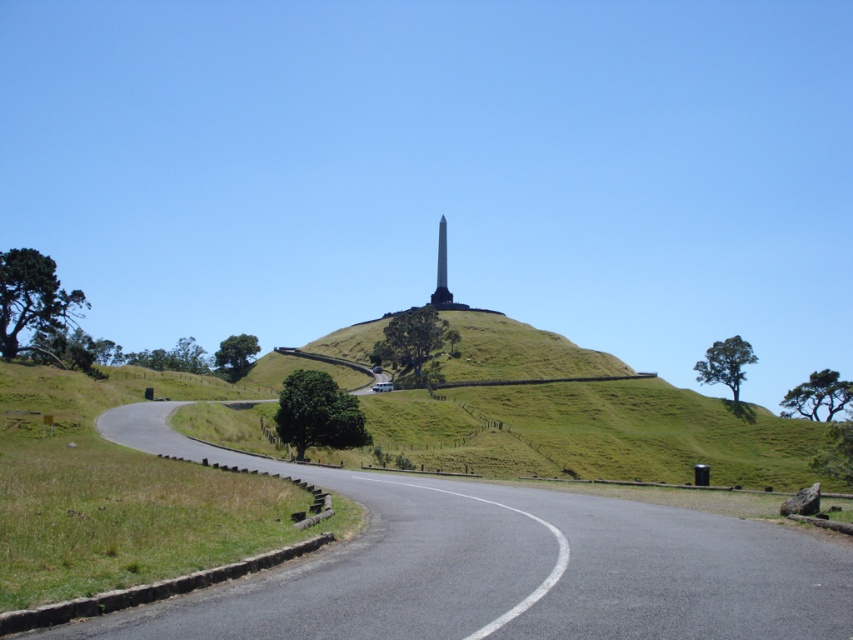
Who is more distant from viewer, [22,403] or [448,305]?

The point [448,305] is more distant.

Is point (292, 540) less distant than point (444, 307)?

That is True.

The width and height of the screenshot is (853, 640). In order to click on green grass at lower left in this screenshot , I will do `click(114, 493)`.